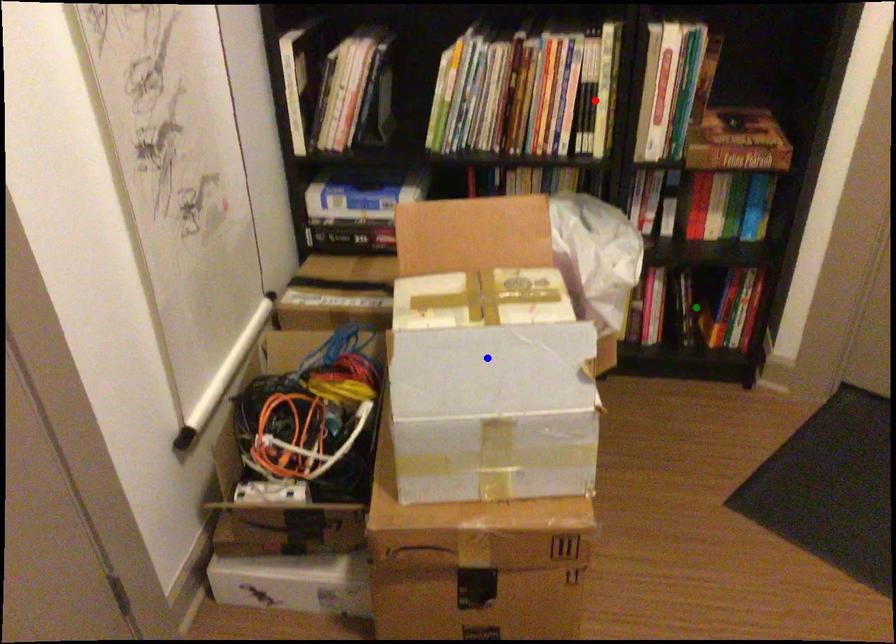
Order these from farthest to nearest:
green point
red point
blue point

green point, red point, blue point